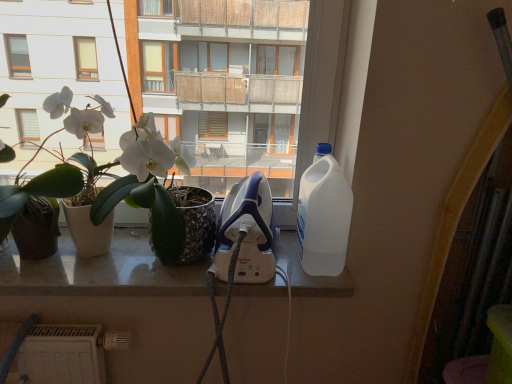
The height and width of the screenshot is (384, 512). Describe the element at coordinates (323, 215) in the screenshot. I see `white plastic bottle at right` at that location.

Where is `green matte plant at left, the 1th houseplant in the left-to-right sequence`? green matte plant at left, the 1th houseplant in the left-to-right sequence is located at coordinates (39, 193).

In terms of width, does white matte plant pot at left, acting as the second houseplant starting from the left, look wider or thinner when compared to green matte plant at left, placed as the second houseplant when sorted from right to left?

In the image, white matte plant pot at left, acting as the second houseplant starting from the left, appears to be more narrow than green matte plant at left, placed as the second houseplant when sorted from right to left.

Can green matte plant at left, placed as the second houseplant when sorted from right to left, be found inside white matte plant pot at left, which is the 1th houseplant from right to left?

Absolutely, green matte plant at left, placed as the second houseplant when sorted from right to left, is inside white matte plant pot at left, which is the 1th houseplant from right to left.

Does point (59, 102) lie behind point (38, 181)?

That is False.

Based on their positions, is white matte plant pot at left, which is the 1th houseplant from right to left, located to the left or right of green matte plant at left, the 1th houseplant in the left-to-right sequence?

From the image, it's evident that white matte plant pot at left, which is the 1th houseplant from right to left, is to the right of green matte plant at left, the 1th houseplant in the left-to-right sequence.

How many degrees apart are the facing directions of white glossy iron at center and white matte plant pot at left, which is the 1th houseplant from right to left?

The angular difference between white glossy iron at center and white matte plant pot at left, which is the 1th houseplant from right to left, is 0.0154 degrees.

Could you tell me if white glossy iron at center is facing white matte plant pot at left, acting as the second houseplant starting from the left?

No, white glossy iron at center does not turn towards white matte plant pot at left, acting as the second houseplant starting from the left.

Between white glossy iron at center and white matte plant pot at left, which is the 1th houseplant from right to left, which one appears on the right side from the viewer's perspective?

From the viewer's perspective, white glossy iron at center appears more on the right side.

How many degrees apart are the facing directions of white plastic bottle at right and green matte plant at left, the 1th houseplant in the left-to-right sequence?

white plastic bottle at right and green matte plant at left, the 1th houseplant in the left-to-right sequence, are facing 6.16 degrees away from each other.

Which of these two, white plastic bottle at right or green matte plant at left, the 1th houseplant in the left-to-right sequence, is wider?

green matte plant at left, the 1th houseplant in the left-to-right sequence.

Based on the photo, is green matte plant at left, placed as the second houseplant when sorted from right to left, located within white plastic bottle at right?

No, green matte plant at left, placed as the second houseplant when sorted from right to left, is not inside white plastic bottle at right.

Which is behind, white plastic bottle at right or green matte plant at left, the 1th houseplant in the left-to-right sequence?

white plastic bottle at right.

From a real-world perspective, is green matte plant at left, placed as the second houseplant when sorted from right to left, positioned above or below white matte plant pot at left, acting as the second houseplant starting from the left?

Clearly, from a real-world perspective, green matte plant at left, placed as the second houseplant when sorted from right to left, is below white matte plant pot at left, acting as the second houseplant starting from the left.

Can you tell me how much green matte plant at left, placed as the second houseplant when sorted from right to left, and white matte plant pot at left, which is the 1th houseplant from right to left, differ in facing direction?

They differ by 1.09 degrees in their facing directions.

Does green matte plant at left, the 1th houseplant in the left-to-right sequence, turn towards white matte plant pot at left, acting as the second houseplant starting from the left?

Yes, green matte plant at left, the 1th houseplant in the left-to-right sequence, faces towards white matte plant pot at left, acting as the second houseplant starting from the left.

Is green matte plant at left, placed as the second houseplant when sorted from right to left, bigger than white matte plant pot at left, which is the 1th houseplant from right to left?

No.

Is white plastic bottle at right a part of white matte plant pot at left, acting as the second houseplant starting from the left?

No, white plastic bottle at right is not a part of white matte plant pot at left, acting as the second houseplant starting from the left.

Considering the relative positions of white matte plant pot at left, which is the 1th houseplant from right to left, and white plastic bottle at right in the image provided, is white matte plant pot at left, which is the 1th houseplant from right to left, in front of white plastic bottle at right?

Yes, it is.

Is white matte plant pot at left, which is the 1th houseplant from right to left, positioned far away from white plastic bottle at right?

No, there isn't a large distance between white matte plant pot at left, which is the 1th houseplant from right to left, and white plastic bottle at right.

How much distance is there between white glossy iron at center and white plastic bottle at right?

10.56 inches.

Does white glossy iron at center have a lesser width compared to white plastic bottle at right?

No, white glossy iron at center is not thinner than white plastic bottle at right.

From their relative heights in the image, would you say white glossy iron at center is taller or shorter than white plastic bottle at right?

In the image, white glossy iron at center appears to be shorter than white plastic bottle at right.

Can you confirm if white glossy iron at center is smaller than white plastic bottle at right?

No, white glossy iron at center is not smaller than white plastic bottle at right.

Which is in front, white matte plant pot at left, which is the 1th houseplant from right to left, or white glossy iron at center?

white matte plant pot at left, which is the 1th houseplant from right to left, is closer to the camera.

Based on the photo, could white glossy iron at center be considered to be inside white matte plant pot at left, which is the 1th houseplant from right to left?

No, white glossy iron at center is not surrounded by white matte plant pot at left, which is the 1th houseplant from right to left.

Considering the positions of objects white matte plant pot at left, which is the 1th houseplant from right to left, and white glossy iron at center in the image provided, who is more to the left, white matte plant pot at left, which is the 1th houseplant from right to left, or white glossy iron at center?

white matte plant pot at left, which is the 1th houseplant from right to left.

Considering the relative sizes of white matte plant pot at left, which is the 1th houseplant from right to left, and white glossy iron at center in the image provided, is white matte plant pot at left, which is the 1th houseplant from right to left, thinner than white glossy iron at center?

Correct, the width of white matte plant pot at left, which is the 1th houseplant from right to left, is less than that of white glossy iron at center.

What are the coordinates of `houseplant below the white matte plant pot at left, which is the 1th houseplant from right to left (from a real-world perspective)` in the screenshot? It's located at (39, 193).

Identify the location of the 1st houseplant counting from the left side of the white glossy iron at center. (114, 186).

Based on the photo, looking at the image, which one is located closer to white glossy iron at center, green matte plant at left, the 1th houseplant in the left-to-right sequence, or white matte plant pot at left, acting as the second houseplant starting from the left?

Based on the image, white matte plant pot at left, acting as the second houseplant starting from the left, appears to be nearer to white glossy iron at center.

When comparing their distances from green matte plant at left, placed as the second houseplant when sorted from right to left, does white glossy iron at center or white plastic bottle at right seem further?

Among the two, white plastic bottle at right is located further to green matte plant at left, placed as the second houseplant when sorted from right to left.

Estimate the real-world distances between objects in this image. Which object is further from white plastic bottle at right, green matte plant at left, the 1th houseplant in the left-to-right sequence, or white glossy iron at center?

green matte plant at left, the 1th houseplant in the left-to-right sequence, is further to white plastic bottle at right.

Based on the photo, based on their spatial positions, is white plastic bottle at right or white glossy iron at center closer to white matte plant pot at left, which is the 1th houseplant from right to left?

The object closer to white matte plant pot at left, which is the 1th houseplant from right to left, is white glossy iron at center.

Looking at the image, which one is located closer to green matte plant at left, placed as the second houseplant when sorted from right to left, white matte plant pot at left, which is the 1th houseplant from right to left, or white plastic bottle at right?

The object closer to green matte plant at left, placed as the second houseplant when sorted from right to left, is white matte plant pot at left, which is the 1th houseplant from right to left.

Considering their positions, is green matte plant at left, placed as the second houseplant when sorted from right to left, positioned further to white plastic bottle at right than white matte plant pot at left, acting as the second houseplant starting from the left?

green matte plant at left, placed as the second houseplant when sorted from right to left, lies further to white plastic bottle at right than the other object.

In the scene shown: Estimate the real-world distances between objects in this image. Which object is closer to white matte plant pot at left, which is the 1th houseplant from right to left, white glossy iron at center or white plastic bottle at right?

white glossy iron at center is closer to white matte plant pot at left, which is the 1th houseplant from right to left.

In the scene shown: Which object lies nearer to the anchor point white glossy iron at center, green matte plant at left, placed as the second houseplant when sorted from right to left, or white plastic bottle at right?

green matte plant at left, placed as the second houseplant when sorted from right to left, is closer to white glossy iron at center.

The height and width of the screenshot is (384, 512). I want to click on window between green matte plant at left, placed as the second houseplant when sorted from right to left, and white plastic bottle at right from left to right, so click(x=101, y=271).

This screenshot has width=512, height=384. In order to click on window between white matte plant pot at left, acting as the second houseplant starting from the left, and white plastic bottle at right in this screenshot , I will do `click(101, 271)`.

This screenshot has width=512, height=384. Find the location of `houseplant situated between green matte plant at left, placed as the second houseplant when sorted from right to left, and white plastic bottle at right from left to right`. houseplant situated between green matte plant at left, placed as the second houseplant when sorted from right to left, and white plastic bottle at right from left to right is located at coordinates (114, 186).

Find the location of a particular element. This screenshot has width=512, height=384. houseplant between green matte plant at left, placed as the second houseplant when sorted from right to left, and white glossy iron at center from left to right is located at coordinates (114, 186).